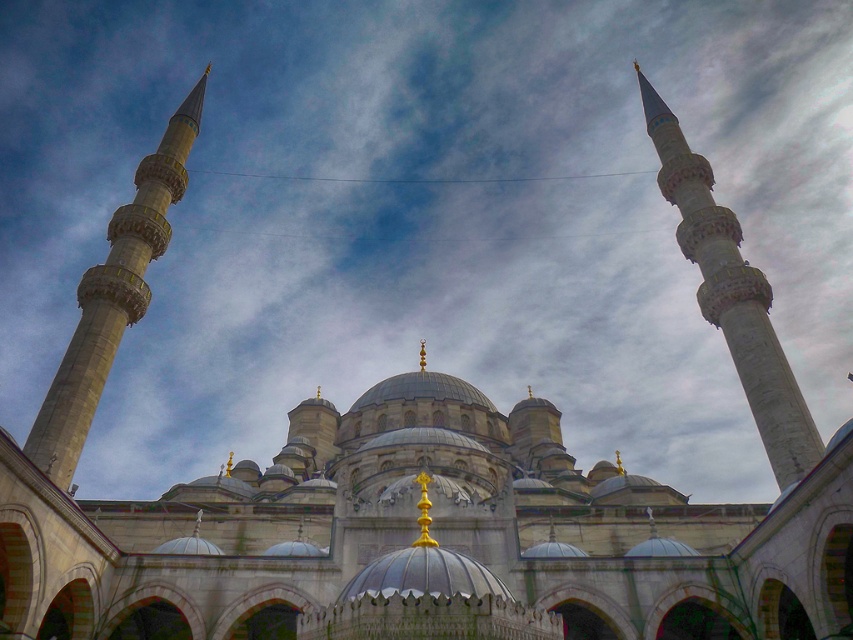
Question: Which point is farther to the camera?

Choices:
 (A) white marble minaret at upper right
 (B) gray stone minaret at left

Answer: (B)

Question: Which object appears farthest from the camera in this image?

Choices:
 (A) gray stone minaret at left
 (B) white marble minaret at upper right

Answer: (A)

Question: Can you confirm if white marble minaret at upper right is positioned to the left of gray stone minaret at left?

Choices:
 (A) yes
 (B) no

Answer: (B)

Question: Does white marble minaret at upper right come behind gray stone minaret at left?

Choices:
 (A) no
 (B) yes

Answer: (A)

Question: Observing the image, what is the correct spatial positioning of white marble minaret at upper right in reference to gray stone minaret at left?

Choices:
 (A) above
 (B) below

Answer: (B)